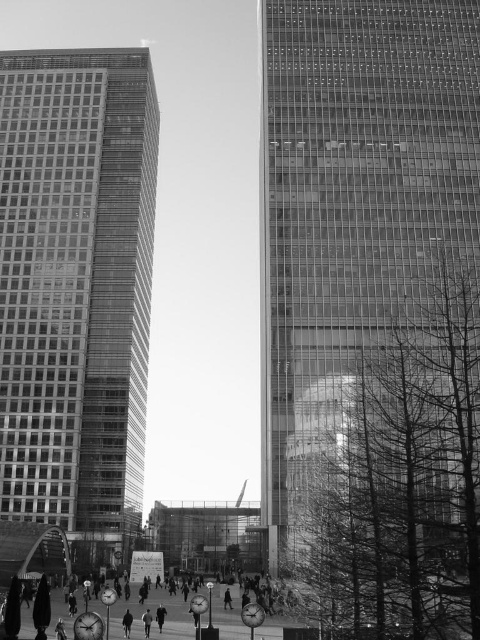
Question: Estimate the real-world distances between objects in this image. Which object is closer to the glassy reflective skyscraper at right?

Choices:
 (A) glassy reflective skyscraper at left
 (B) dark gray clothing at center

Answer: (A)

Question: Can you confirm if glassy reflective skyscraper at right is positioned to the left of dark gray clothing at center?

Choices:
 (A) no
 (B) yes

Answer: (A)

Question: Does glassy reflective skyscraper at left come behind dark gray clothing at center?

Choices:
 (A) yes
 (B) no

Answer: (A)

Question: Which point is closer to the camera?

Choices:
 (A) dark gray clothing at center
 (B) glassy reflective skyscraper at left
 (C) glassy reflective skyscraper at right

Answer: (A)

Question: Is glassy reflective skyscraper at left to the left of dark gray clothing at center from the viewer's perspective?

Choices:
 (A) yes
 (B) no

Answer: (A)

Question: Which point is farther to the camera?

Choices:
 (A) glassy reflective skyscraper at left
 (B) glassy reflective skyscraper at right
 (C) dark gray clothing at center

Answer: (A)